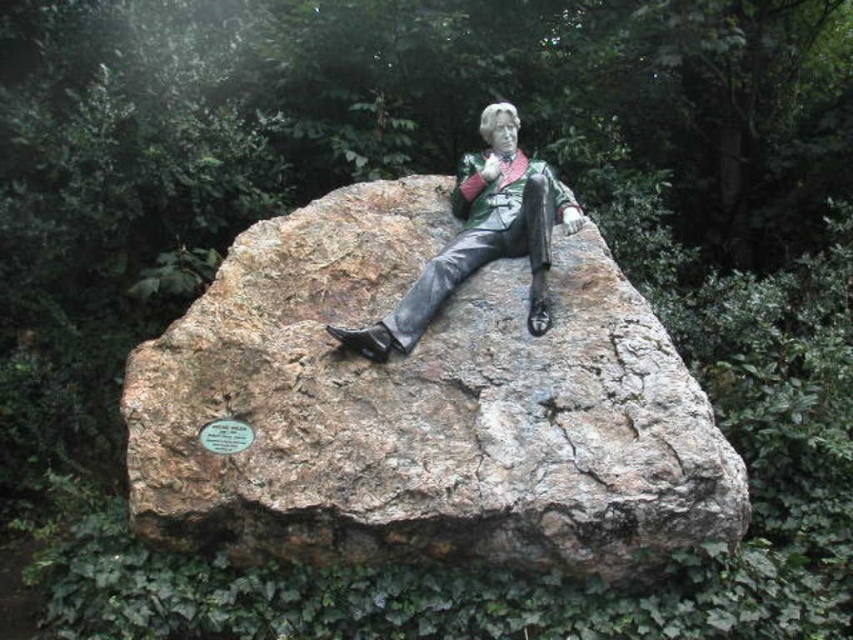
Does point (167, 396) lie in front of point (490, 168)?

Yes, point (167, 396) is closer to viewer.

Image resolution: width=853 pixels, height=640 pixels. What do you see at coordinates (422, 406) in the screenshot? I see `rustic stone at center` at bounding box center [422, 406].

The image size is (853, 640). Find the location of `rustic stone at center`. rustic stone at center is located at coordinates (422, 406).